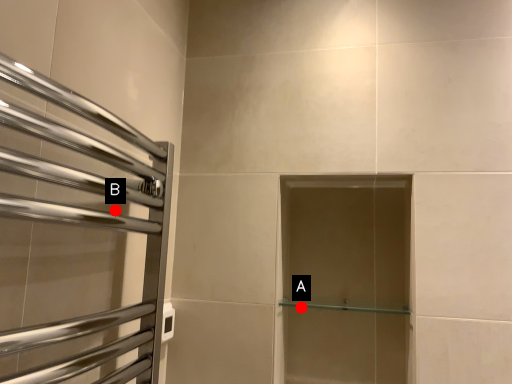
Question: Two points are circled on the image, labeled by A and B beside each circle. Which point is farther to the camera?

Choices:
 (A) A is further
 (B) B is further

Answer: (A)